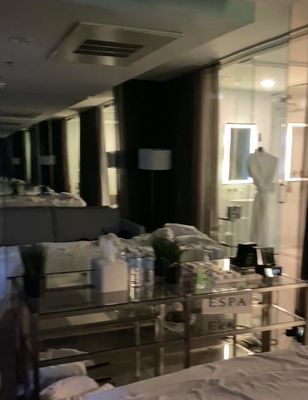
Where is `the left arm of the sofa`? Image resolution: width=308 pixels, height=400 pixels. the left arm of the sofa is located at coordinates (131, 223).